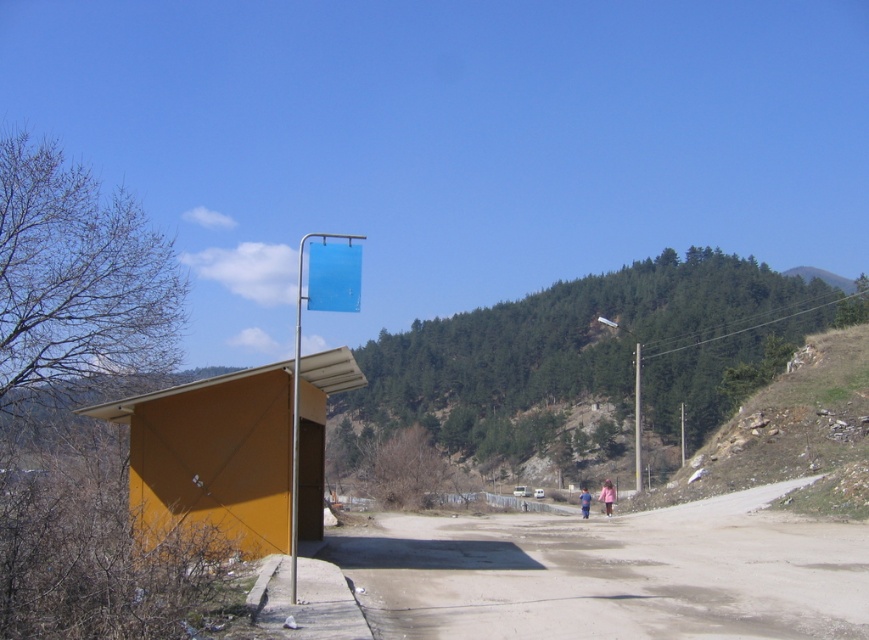
Image resolution: width=869 pixels, height=640 pixels. What do you see at coordinates (611, 572) in the screenshot?
I see `dirt road at center` at bounding box center [611, 572].

Does dirt road at center have a lesser height compared to blue plastic sign at center?

Correct, dirt road at center is not as tall as blue plastic sign at center.

The width and height of the screenshot is (869, 640). What do you see at coordinates (611, 572) in the screenshot?
I see `dirt road at center` at bounding box center [611, 572].

The height and width of the screenshot is (640, 869). In order to click on dirt road at center in this screenshot , I will do `click(611, 572)`.

Does dirt road at center appear on the left side of metallic pole at center?

Correct, you'll find dirt road at center to the left of metallic pole at center.

Locate an element on the screen. The height and width of the screenshot is (640, 869). dirt road at center is located at coordinates (611, 572).

Does point (712, 596) lie in front of point (638, 412)?

Yes, it is.

Where is `dirt road at center`? The width and height of the screenshot is (869, 640). dirt road at center is located at coordinates (611, 572).

Does blue plastic sign at center have a lesser height compared to metallic pole at center?

No.

Who is shorter, blue plastic sign at center or metallic pole at center?

metallic pole at center

Is point (342, 253) positioned before point (637, 376)?

Yes.

Locate an element on the screen. Image resolution: width=869 pixels, height=640 pixels. blue plastic sign at center is located at coordinates click(x=300, y=332).